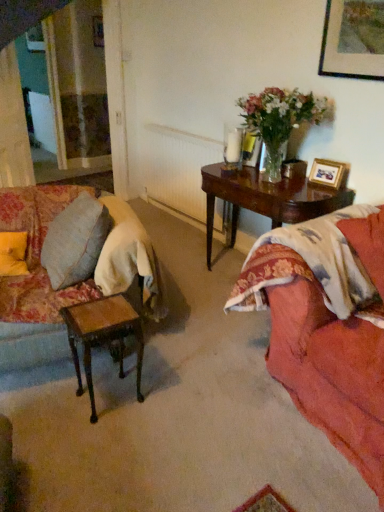
Find the location of a particular element. The height and width of the screenshot is (512, 384). shiny dark wood table at center is located at coordinates (266, 199).

What do you see at coordinates (279, 119) in the screenshot? I see `translucent glass vase at upper right` at bounding box center [279, 119].

The image size is (384, 512). Describe the element at coordinates (35, 281) in the screenshot. I see `velvet floral couch at left` at that location.

Measure the distance between light beige fabric curtain at left and camera.

light beige fabric curtain at left and camera are 3.00 meters apart.

What is the approximate height of wooden side table at lower left?

The height of wooden side table at lower left is 18.39 inches.

Locate an element on the screen. wooden side table at lower left is located at coordinates (102, 336).

You are a GUI agent. You are given a task and a screenshot of the screen. Output one action in this format:
    pyautogui.click(x=<x>, y=<y>)
    Task: Click on the floral fabric bedspread at right
    The height and width of the screenshot is (512, 384).
    Given the screenshot: What is the action you would take?
    pyautogui.click(x=318, y=347)

Is shiny dark wood table at center further to the viewer compared to wooden side table at lower left?

Yes, shiny dark wood table at center is further from the camera.

Can you tell me how much shiny dark wood table at center and wooden side table at lower left differ in facing direction?

The angular difference between shiny dark wood table at center and wooden side table at lower left is 84 degrees.

Would you consider shiny dark wood table at center to be distant from wooden side table at lower left?

Indeed, shiny dark wood table at center is not near wooden side table at lower left.

In the scene shown: From a real-world perspective, is shiny dark wood table at center positioned above or below wooden side table at lower left?

shiny dark wood table at center is situated higher than wooden side table at lower left in the real world.

Can you confirm if translucent glass vase at upper right is bigger than clear glass vase at upper right?

Yes.

Is translucent glass vase at upper right in contact with clear glass vase at upper right?

translucent glass vase at upper right and clear glass vase at upper right are not in contact.

Is translucent glass vase at upper right taller than clear glass vase at upper right?

Yes, translucent glass vase at upper right is taller than clear glass vase at upper right.

Which is behind, point (304, 113) or point (274, 168)?

The point (274, 168) is farther.

You are a GUI agent. You are given a task and a screenshot of the screen. Output one action in this format:
    pyautogui.click(x=<x>, y=<y>)
    Task: Click on the vase that is on the right side of wooden side table at lower left
    
    Given the screenshot: What is the action you would take?
    pyautogui.click(x=272, y=162)

Can you confirm if clear glass vase at upper right is positioned to the left of wooden side table at lower left?

Incorrect, clear glass vase at upper right is not on the left side of wooden side table at lower left.

Choose the correct answer: Is clear glass vase at upper right inside wooden side table at lower left or outside it?

clear glass vase at upper right cannot be found inside wooden side table at lower left.

Considering the sizes of objects clear glass vase at upper right and wooden side table at lower left in the image provided, who is wider, clear glass vase at upper right or wooden side table at lower left?

wooden side table at lower left.

How different are the orientations of translucent glass vase at upper right and wooden side table at lower left in degrees?

The angle between the facing direction of translucent glass vase at upper right and the facing direction of wooden side table at lower left is 84 degrees.

Can you confirm if translucent glass vase at upper right is positioned to the right of wooden side table at lower left?

Correct, you'll find translucent glass vase at upper right to the right of wooden side table at lower left.

Is translucent glass vase at upper right wider than wooden side table at lower left?

Indeed, translucent glass vase at upper right has a greater width compared to wooden side table at lower left.

Is translucent glass vase at upper right looking in the opposite direction of wooden side table at lower left?

translucent glass vase at upper right does not have its back to wooden side table at lower left.

From a real-world perspective, between white textured radiator at center and wooden side table at lower left, who is vertically higher?

white textured radiator at center, from a real-world perspective.

Is white textured radiator at center surrounding wooden side table at lower left?

No, wooden side table at lower left is not surrounded by white textured radiator at center.

Is white textured radiator at center oriented towards wooden side table at lower left?

No, white textured radiator at center does not turn towards wooden side table at lower left.

From the image's perspective, relative to white textured radiator at center, is wooden side table at lower left above or below?

wooden side table at lower left is situated lower than white textured radiator at center in the image.

Is wooden side table at lower left oriented away from white textured radiator at center?

No, wooden side table at lower left is not facing away from white textured radiator at center.

In terms of height, does wooden side table at lower left look taller or shorter compared to white textured radiator at center?

Clearly, wooden side table at lower left is shorter compared to white textured radiator at center.

Does wooden side table at lower left have a greater width compared to white textured radiator at center?

Yes, wooden side table at lower left is wider than white textured radiator at center.

Between light beige fabric curtain at left and wooden picture frame at upper right, which one has smaller width?

With smaller width is wooden picture frame at upper right.

Is light beige fabric curtain at left not near wooden picture frame at upper right?

That's right, there is a large distance between light beige fabric curtain at left and wooden picture frame at upper right.

Does light beige fabric curtain at left have a larger size compared to wooden picture frame at upper right?

Yes.

What's the angular difference between light beige fabric curtain at left and wooden picture frame at upper right's facing directions?

The angular difference between light beige fabric curtain at left and wooden picture frame at upper right is 128 degrees.

This screenshot has height=512, width=384. Find the location of `table in front of the shiny dark wood table at center`. table in front of the shiny dark wood table at center is located at coordinates (102, 336).

At what (x,y) coordinates should I click in order to perform the action: click on floral arrangement located above the clear glass vase at upper right (from a real-world perspective). Please return your answer as a coordinate pair (x, y). The image size is (384, 512). Looking at the image, I should click on (279, 119).

Based on their spatial positions, is wooden picture frame at upper right or white textured radiator at center closer to velvet floral couch at left?

Based on the image, wooden picture frame at upper right appears to be nearer to velvet floral couch at left.

From the image, which object appears to be nearer to translucent glass vase at upper right, white textured radiator at center or wooden picture frame at upper right?

Among the two, wooden picture frame at upper right is located nearer to translucent glass vase at upper right.

Estimate the real-world distances between objects in this image. Which object is closer to white textured radiator at center, shiny dark wood table at center or velvet floral couch at left?

shiny dark wood table at center.

Based on their spatial positions, is shiny dark wood table at center or floral fabric bedspread at right further from light beige fabric curtain at left?

The object further to light beige fabric curtain at left is floral fabric bedspread at right.

Based on their spatial positions, is clear glass vase at upper right or light beige fabric curtain at left closer to velvet floral couch at left?

Among the two, clear glass vase at upper right is located nearer to velvet floral couch at left.

Looking at the image, which one is located further to shiny dark wood table at center, floral fabric bedspread at right or velvet floral couch at left?

velvet floral couch at left.

Based on their spatial positions, is velvet floral couch at left or wooden picture frame at upper right closer to clear glass vase at upper right?

The object closer to clear glass vase at upper right is wooden picture frame at upper right.

Which object lies nearer to the anchor point floral fabric bedspread at right, translucent glass vase at upper right or light beige fabric curtain at left?

Among the two, translucent glass vase at upper right is located nearer to floral fabric bedspread at right.

At what (x,y) coordinates should I click in order to perform the action: click on curtain positioned between wooden side table at lower left and white textured radiator at center from near to far. Please return your answer as a coordinate pair (x, y). Image resolution: width=384 pixels, height=512 pixels. Looking at the image, I should click on (13, 125).

I want to click on picture frame located between wooden side table at lower left and white textured radiator at center in the depth direction, so click(327, 173).

The height and width of the screenshot is (512, 384). What are the coordinates of `picture frame between wooden side table at lower left and floral fabric bedspread at right from left to right` in the screenshot? It's located at (327, 173).

This screenshot has width=384, height=512. I want to click on floral arrangement between velvet floral couch at left and shiny dark wood table at center from left to right, so click(x=279, y=119).